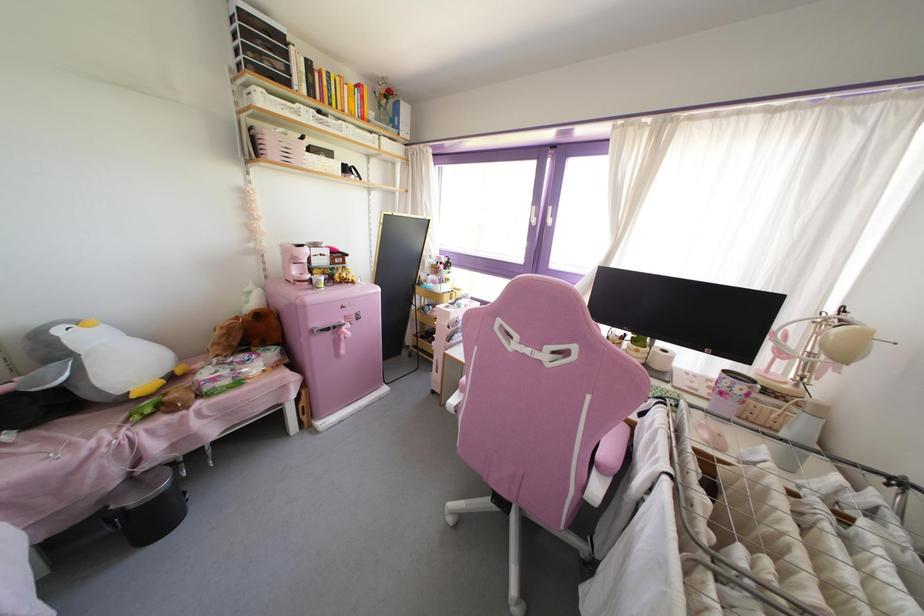
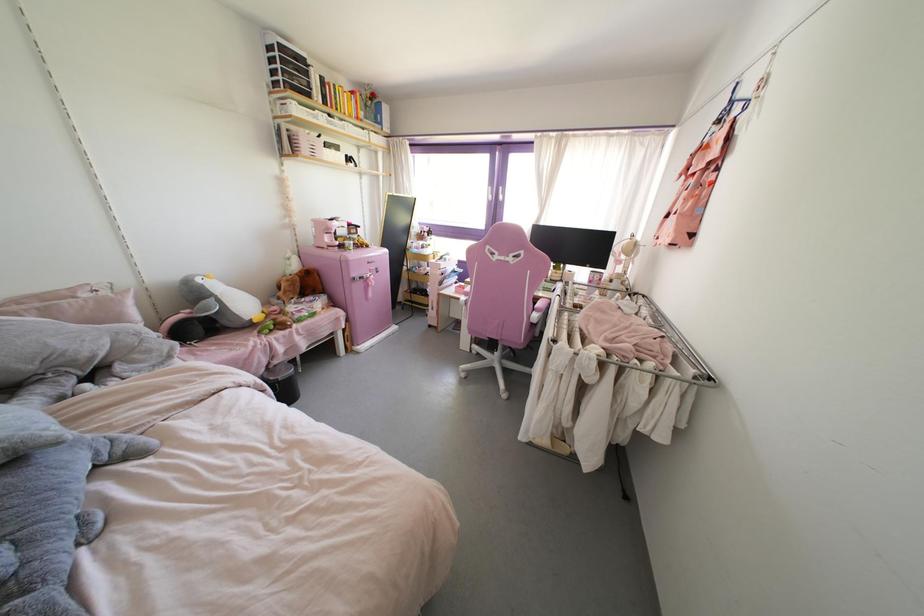
Question: The camera is either moving clockwise (left) or counter-clockwise (right) around the object. The first image is from the beginning of the video and the second image is from the end. Is the camera moving left or right when shooting the video?

Choices:
 (A) Left
 (B) Right

Answer: (A)